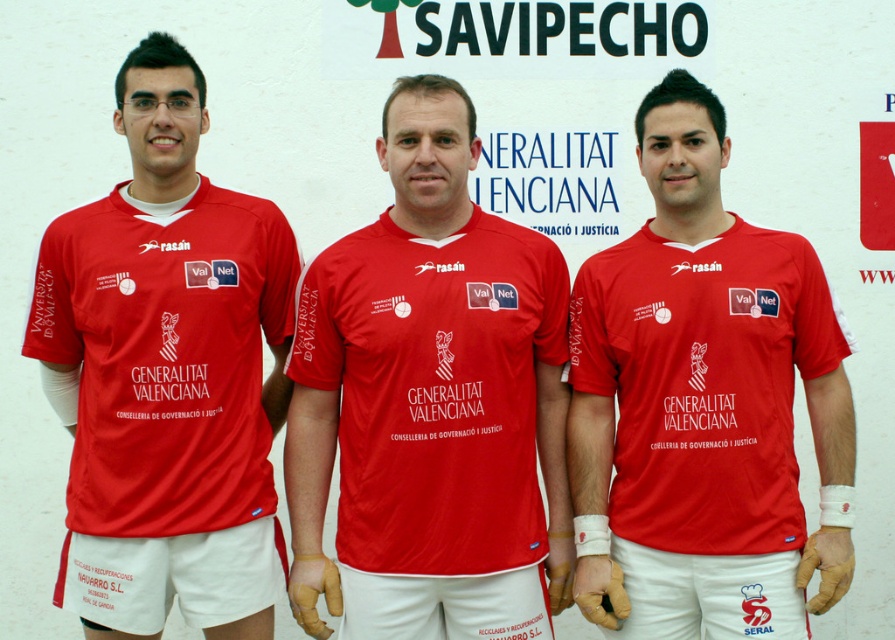
Who is shorter, matte jersey at center or matte red shirt at center?

matte red shirt at center

Can you confirm if matte jersey at center is positioned to the left of matte red shirt at center?

Yes, matte jersey at center is to the left of matte red shirt at center.

This screenshot has width=895, height=640. Describe the element at coordinates (430, 403) in the screenshot. I see `matte jersey at center` at that location.

At what (x,y) coordinates should I click in order to perform the action: click on matte jersey at center. Please return your answer as a coordinate pair (x, y). Looking at the image, I should click on (430, 403).

Is point (747, 348) positioned in front of point (131, 120)?

Yes.

Does matte red shirt at center lie behind matte red jersey at left?

No, it is not.

Is point (674, 131) closer to viewer compared to point (81, 477)?

Yes, it is.

At what (x,y) coordinates should I click in order to perform the action: click on matte red shirt at center. Please return your answer as a coordinate pair (x, y). This screenshot has width=895, height=640. Looking at the image, I should click on tap(703, 404).

Consider the image. Does matte jersey at center appear under matte red jersey at left?

Yes.

Can you confirm if matte jersey at center is positioned above matte red jersey at left?

Actually, matte jersey at center is below matte red jersey at left.

Does point (482, 451) come farther from viewer compared to point (266, 513)?

No.

The height and width of the screenshot is (640, 895). In order to click on matte jersey at center in this screenshot , I will do `click(430, 403)`.